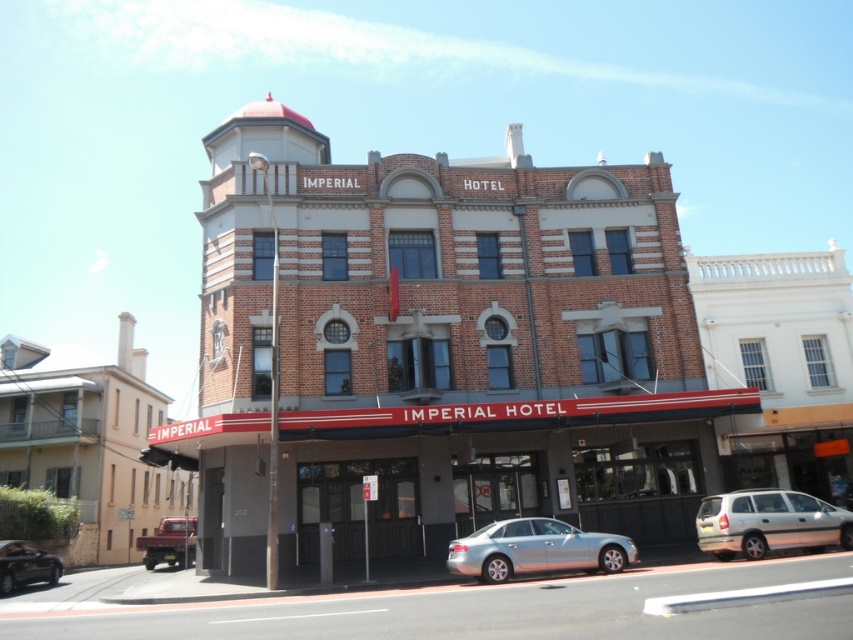
Can you confirm if beige brick building at lower left is shorter than silver metallic sedan at lower center?

No.

Does beige brick building at lower left appear over silver metallic sedan at lower center?

Incorrect, beige brick building at lower left is not positioned above silver metallic sedan at lower center.

At what (x,y) coordinates should I click in order to perform the action: click on beige brick building at lower left. Please return your answer as a coordinate pair (x, y). This screenshot has width=853, height=640. Looking at the image, I should click on tap(88, 440).

Find the location of a particular element. The height and width of the screenshot is (640, 853). beige brick building at lower left is located at coordinates (88, 440).

Consider the image. Who is positioned more to the right, beige brick building at lower left or metallic maroon truck at lower left?

Positioned to the right is metallic maroon truck at lower left.

Does point (24, 440) come in front of point (155, 536)?

No, it is behind (155, 536).

Is point (1, 403) positioned in front of point (161, 531)?

No, (1, 403) is further to viewer.

Locate an element on the screen. The image size is (853, 640). beige brick building at lower left is located at coordinates (88, 440).

Who is positioned more to the left, brown brick building at center or silver metallic van at lower right?

brown brick building at center

Does brown brick building at center come behind silver metallic van at lower right?

Yes.

Who is more forward, (x=630, y=268) or (x=827, y=545)?

Point (x=827, y=545) is more forward.

Find the location of `brown brick building at center`. brown brick building at center is located at coordinates (430, 344).